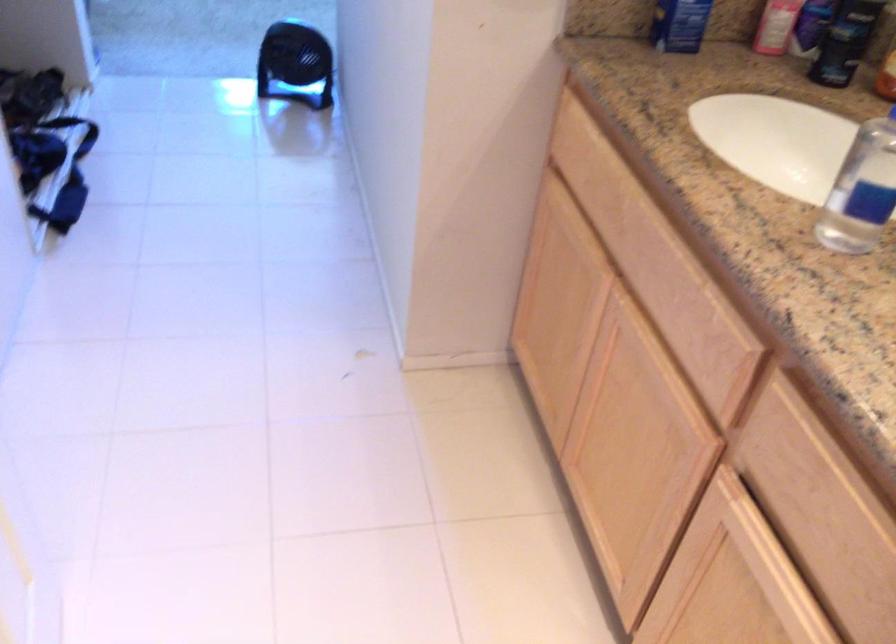
The height and width of the screenshot is (644, 896). What do you see at coordinates (684, 429) in the screenshot? I see `the wooden cabinet pull` at bounding box center [684, 429].